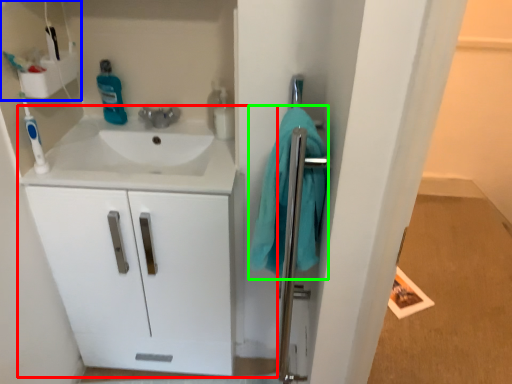
Question: Considering the real-world distances, which object is closest to bathroom cabinet (highlighted by a red box)? shelf (highlighted by a blue box) or bath towel (highlighted by a green box).

Choices:
 (A) shelf
 (B) bath towel

Answer: (B)